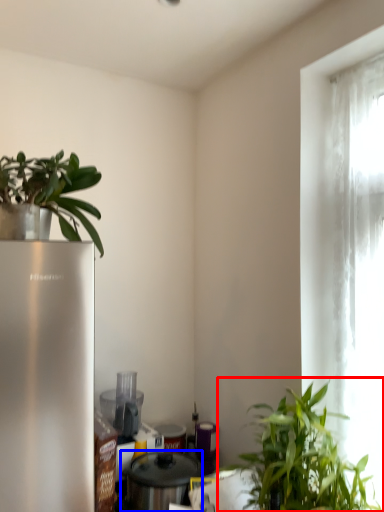
Question: Among these objects, which one is farthest to the camera, houseplant (highlighted by a red box) or appliance (highlighted by a blue box)?

Choices:
 (A) houseplant
 (B) appliance

Answer: (B)